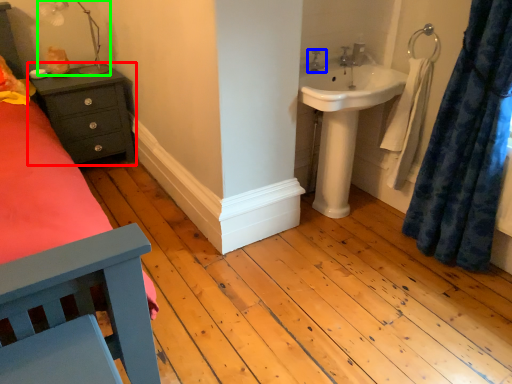
Question: Estimate the real-world distances between objects in this image. Which object is farther from nightstand (highlighted by a red box), tap (highlighted by a blue box) or lamp (highlighted by a green box)?

Choices:
 (A) tap
 (B) lamp

Answer: (A)